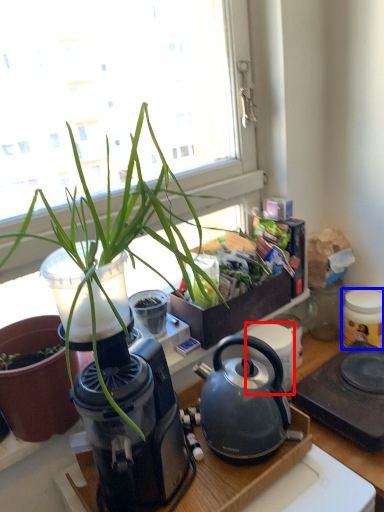
Question: Which object is further to the camera taking this photo, appliance (highlighted by a red box) or appliance (highlighted by a blue box)?

Choices:
 (A) appliance
 (B) appliance

Answer: (B)